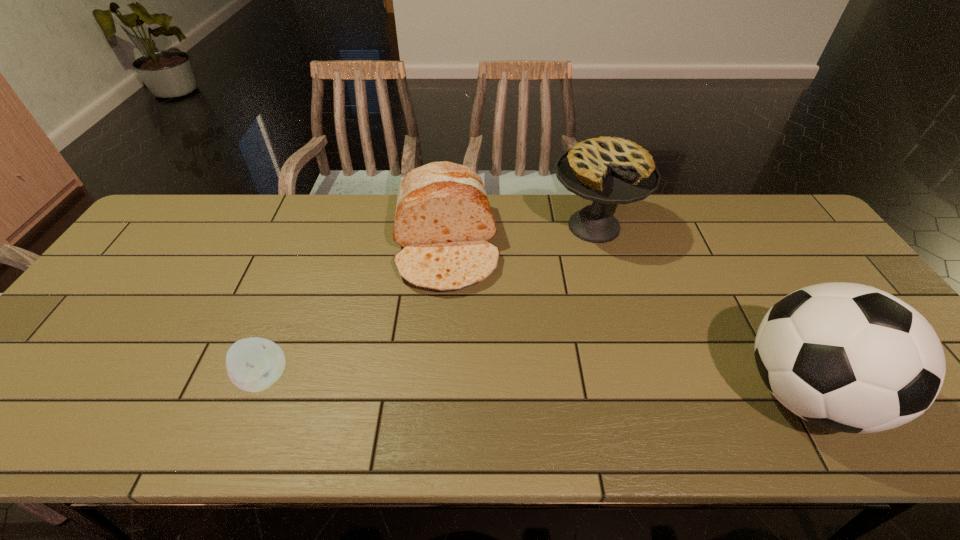
Find the location of a particular element. Image resolution: width=960 pixels, height=540 pixels. free spot on the desktop that is between the leftmost object and the rightmost object and is positioned at the sliced end of the bread is located at coordinates (459, 383).

At what (x,y) coordinates should I click in order to perform the action: click on free space on the desktop that is between the leftmost object and the soccer ball and is positioned on the cut side of the second object from right to left. Please return your answer as a coordinate pair (x, y). The width and height of the screenshot is (960, 540). Looking at the image, I should click on (585, 387).